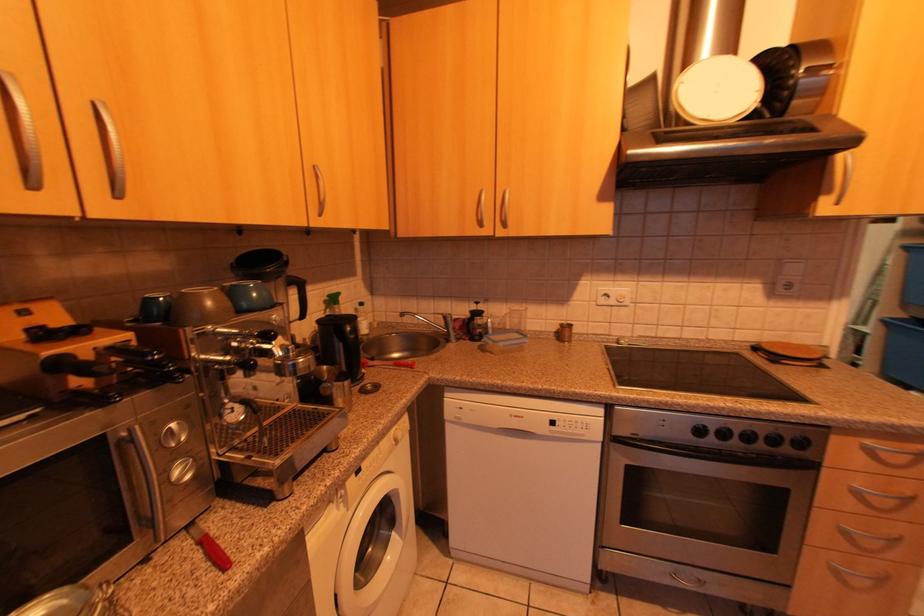
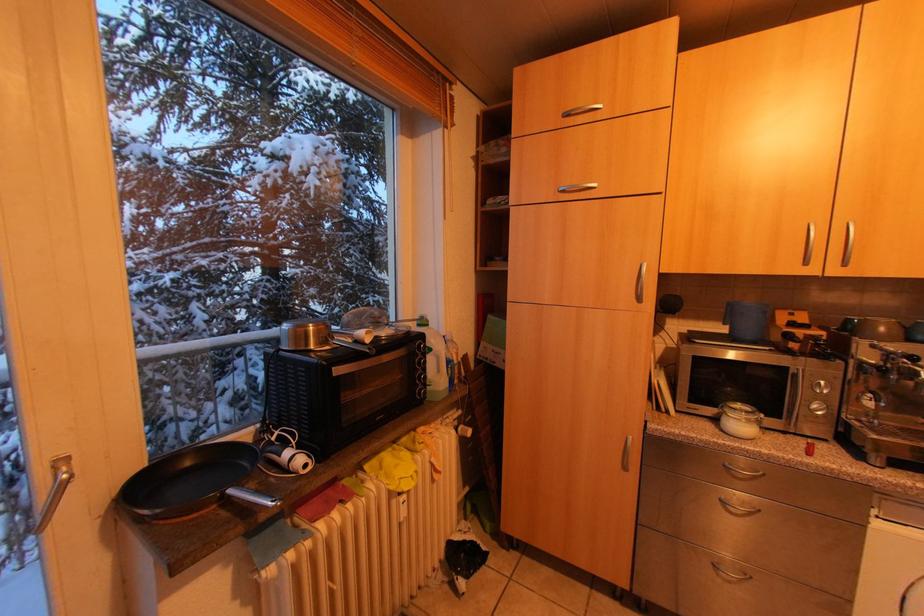
Question: The first image is from the beginning of the video and the second image is from the end. How did the camera likely rotate when shooting the video?

Choices:
 (A) Left
 (B) Right
 (C) Up
 (D) Down

Answer: (A)